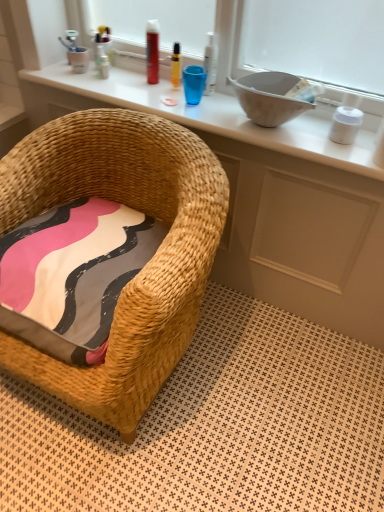
Find the location of a particular element. vacant point to the left of white plastic bottle at upper center, which ranks as the 1th toiletry in left-to-right order is located at coordinates (73, 70).